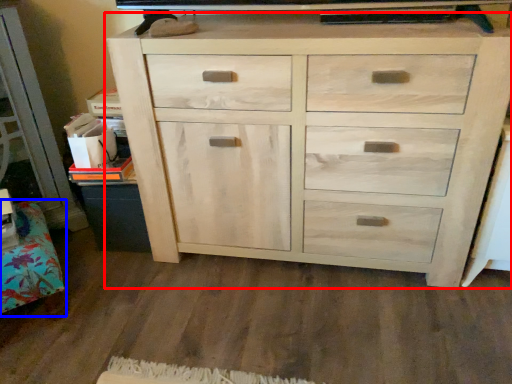
Question: Which point is further to the camera, chest of drawers (highlighted by a red box) or cabinetry (highlighted by a blue box)?

Choices:
 (A) chest of drawers
 (B) cabinetry

Answer: (B)